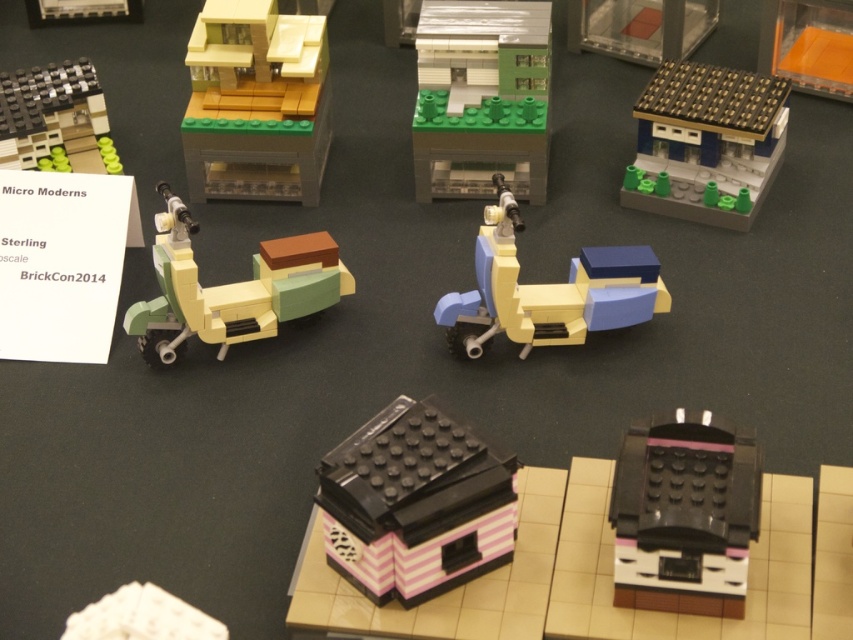
You are a LEGO enthusiast attending BrickCon2014. You want to place a new LEGO set on the display table but need to know which object takes up more space. Which occupies more area on the table between the light brown matte building at upper left and the matte green plastic scooter at center?

The matte green plastic scooter at center occupies more space than the light brown matte building at upper left.

Looking at this image, you are at an exhibition and want to take a photo of both the matte plastic scooter at center and the matte black building at upper left. Which object should you focus on first if you want to capture both in the same frame without moving the camera?

The matte plastic scooter at center is to the right of the matte black building at upper left, so you should focus on the matte black building at upper left first to ensure both are in the frame.

You are at a LEGO exhibition and want to take a photo of the matte plastic scooter at center without any obstructions. However, the matte black building at upper left is blocking your view. Can you move the scooter forward so it is no longer under the building?

The matte plastic scooter at center is positioned under the matte black building at upper left. To avoid obstruction, moving the scooter forward would place it out from under the building, allowing an unobstructed photo.